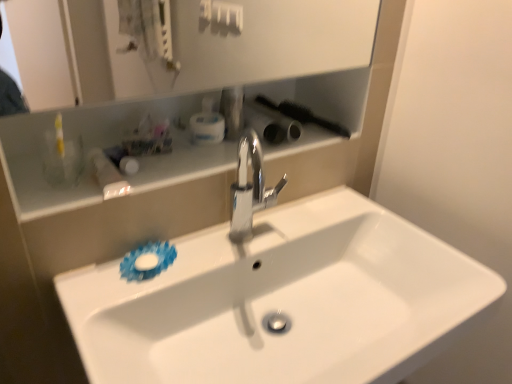
Question: Which direction should I rotate to look at metallic silver faucet at center, arranged as the third toiletry when viewed from the left, — up or down?

Choices:
 (A) up
 (B) down

Answer: (A)

Question: Does white plastic container at upper center, positioned as the second toiletry in left-to-right order, turn towards white glossy bottle at upper left, placed as the 1th toiletry when sorted from left to right?

Choices:
 (A) no
 (B) yes

Answer: (A)

Question: From a real-world perspective, is white plastic container at upper center, arranged as the 2th toiletry when viewed from the right, positioned under white glossy bottle at upper left, which appears as the 3th toiletry when viewed from the right, based on gravity?

Choices:
 (A) yes
 (B) no

Answer: (B)

Question: Considering the relative sizes of white plastic container at upper center, positioned as the second toiletry in left-to-right order, and white glossy bottle at upper left, placed as the 1th toiletry when sorted from left to right, in the image provided, is white plastic container at upper center, positioned as the second toiletry in left-to-right order, shorter than white glossy bottle at upper left, placed as the 1th toiletry when sorted from left to right,?

Choices:
 (A) no
 (B) yes

Answer: (A)

Question: Is white plastic container at upper center, arranged as the 2th toiletry when viewed from the right, facing away from white glossy bottle at upper left, which appears as the 3th toiletry when viewed from the right?

Choices:
 (A) no
 (B) yes

Answer: (A)

Question: Does white plastic container at upper center, arranged as the 2th toiletry when viewed from the right, have a smaller size compared to white glossy bottle at upper left, which appears as the 3th toiletry when viewed from the right?

Choices:
 (A) yes
 (B) no

Answer: (A)

Question: Considering the relative sizes of white plastic container at upper center, positioned as the second toiletry in left-to-right order, and white glossy bottle at upper left, placed as the 1th toiletry when sorted from left to right, in the image provided, is white plastic container at upper center, positioned as the second toiletry in left-to-right order, bigger than white glossy bottle at upper left, placed as the 1th toiletry when sorted from left to right,?

Choices:
 (A) no
 (B) yes

Answer: (A)

Question: Is white glossy sink at center facing towards metallic silver faucet at center, arranged as the third toiletry when viewed from the left?

Choices:
 (A) no
 (B) yes

Answer: (A)

Question: Can you confirm if white glossy sink at center is taller than metallic silver faucet at center, the 1th toiletry from the right?

Choices:
 (A) no
 (B) yes

Answer: (B)

Question: Considering the relative sizes of white glossy sink at center and metallic silver faucet at center, the 1th toiletry from the right, in the image provided, is white glossy sink at center bigger than metallic silver faucet at center, the 1th toiletry from the right,?

Choices:
 (A) yes
 (B) no

Answer: (A)

Question: From a real-world perspective, does white glossy sink at center stand above metallic silver faucet at center, the 1th toiletry from the right?

Choices:
 (A) no
 (B) yes

Answer: (A)

Question: Is white glossy sink at center looking in the opposite direction of metallic silver faucet at center, arranged as the third toiletry when viewed from the left?

Choices:
 (A) yes
 (B) no

Answer: (B)

Question: Does white glossy sink at center appear on the right side of metallic silver faucet at center, the 1th toiletry from the right?

Choices:
 (A) no
 (B) yes

Answer: (B)

Question: From the image's perspective, is white glossy sink at center under white plastic container at upper center, arranged as the 2th toiletry when viewed from the right?

Choices:
 (A) yes
 (B) no

Answer: (A)